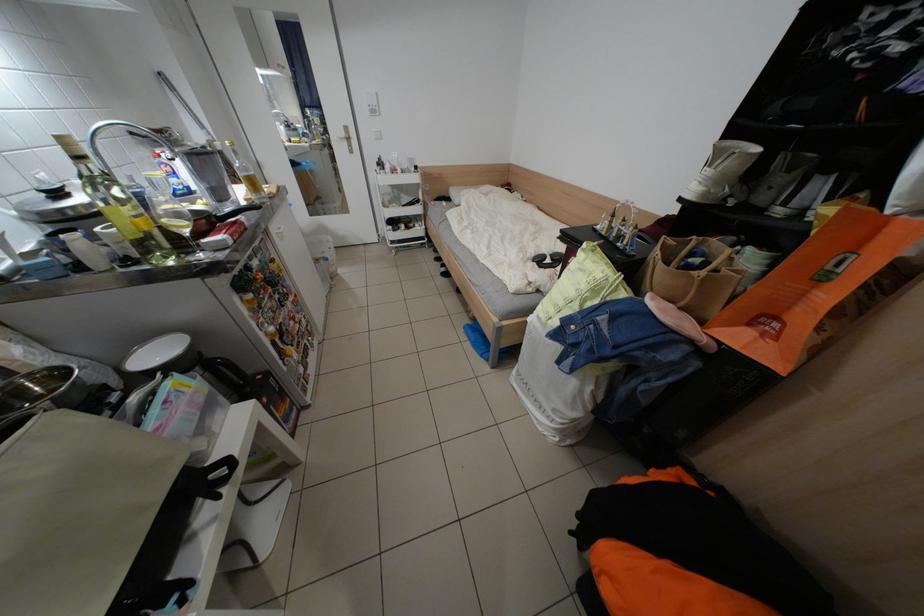
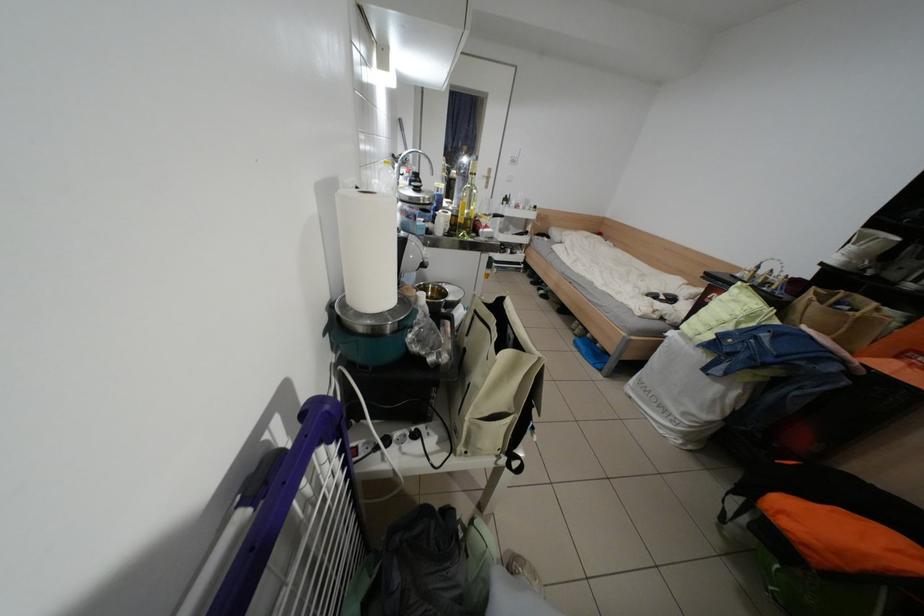
Where in the second image is the point corresponding to the point at 672,265 from the first image?

(827, 305)